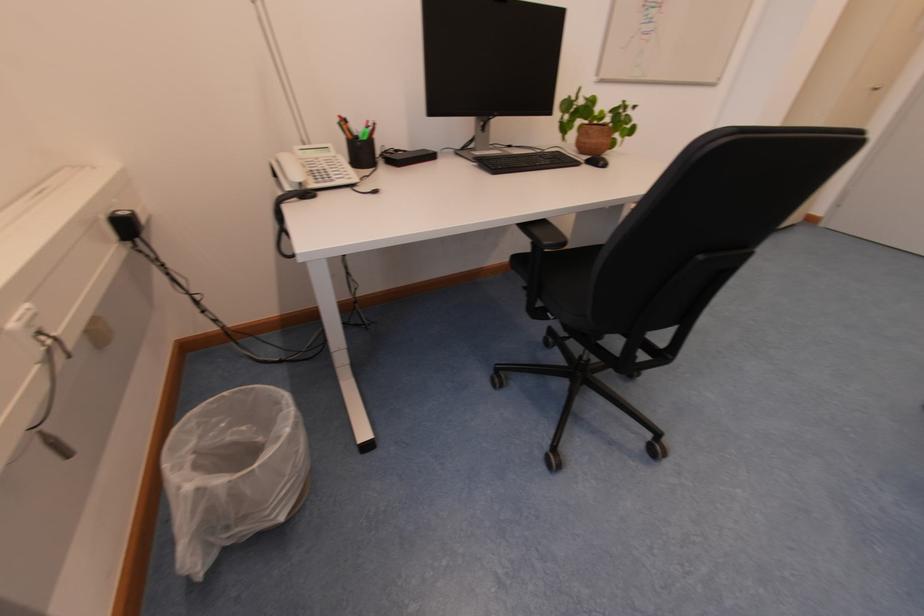
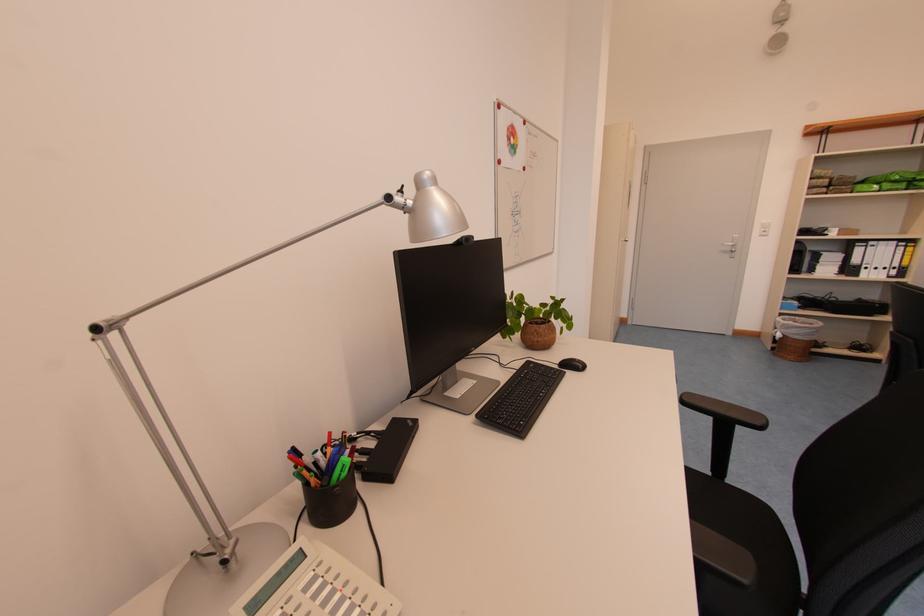
In the second image, find the point that corresponds to point 372,140 in the first image.

(351, 477)